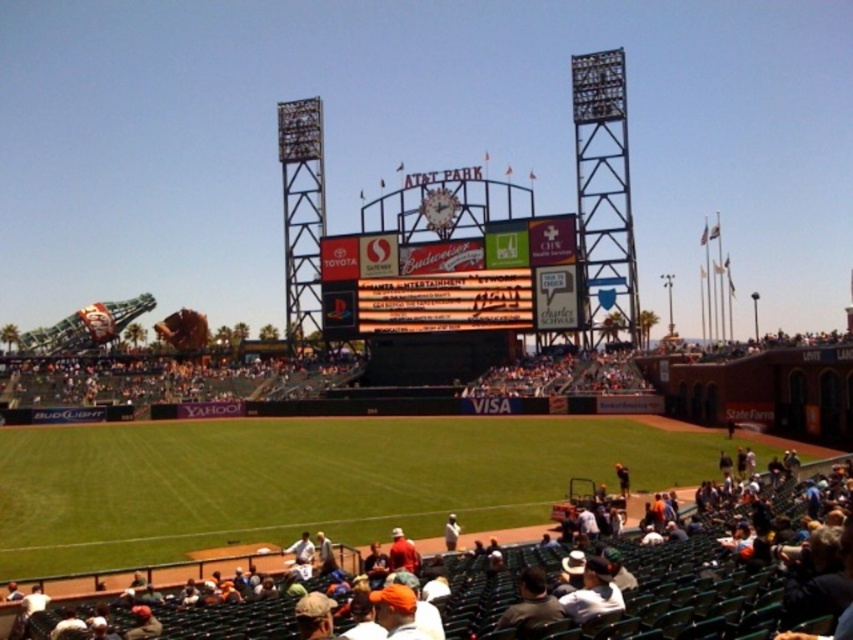
Between multicolored digital display at center and white jersey at center, which one has more height?

With more height is multicolored digital display at center.

Can you confirm if multicolored digital display at center is taller than white jersey at center?

Indeed, multicolored digital display at center has a greater height compared to white jersey at center.

Who is more distant from viewer, [503,272] or [448,529]?

The point [503,272] is more distant.

Where is `multicolored digital display at center`? multicolored digital display at center is located at coordinates (451, 280).

How much distance is there between multicolored digital display at center and white cotton cap at lower center?

44.32 meters

Does multicolored digital display at center appear under white cotton cap at lower center?

Actually, multicolored digital display at center is above white cotton cap at lower center.

Between point (358, 332) and point (585, 611), which one is positioned in front?

Point (585, 611)

The width and height of the screenshot is (853, 640). In order to click on multicolored digital display at center in this screenshot , I will do `click(451, 280)`.

Who is lower down, white cotton cap at lower center or dark gray shirt at lower center?

dark gray shirt at lower center

Who is taller, white cotton cap at lower center or dark gray shirt at lower center?

dark gray shirt at lower center

Who is more forward, (595, 588) or (543, 586)?

Point (543, 586)

You are a GUI agent. You are given a task and a screenshot of the screen. Output one action in this format:
    pyautogui.click(x=<x>, y=<y>)
    Task: Click on the white cotton cap at lower center
    This screenshot has width=853, height=640.
    Given the screenshot: What is the action you would take?
    pyautogui.click(x=593, y=593)